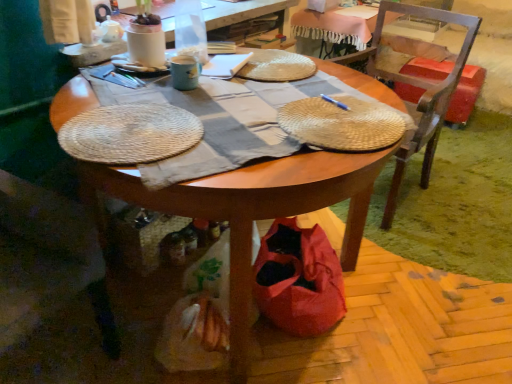
Image resolution: width=512 pixels, height=384 pixels. In order to click on unoccupied area behind woven straw placemat at center in this screenshot , I will do `click(313, 80)`.